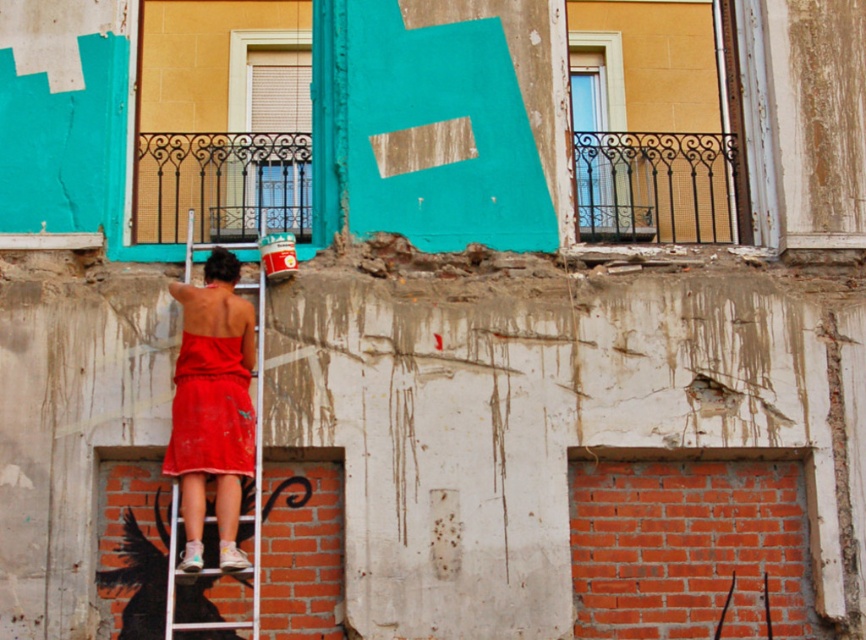
Question: Which object appears farthest from the camera in this image?

Choices:
 (A) white metallic ladder at center
 (B) teal matte letter at center

Answer: (B)

Question: Is teal matte letter at center positioned before white metallic ladder at center?

Choices:
 (A) no
 (B) yes

Answer: (A)

Question: Which point is closer to the camera?

Choices:
 (A) (427, 35)
 (B) (202, 518)

Answer: (B)

Question: Does teal matte letter at center have a smaller size compared to white metallic ladder at center?

Choices:
 (A) yes
 (B) no

Answer: (A)

Question: Is teal matte letter at center in front of white metallic ladder at center?

Choices:
 (A) yes
 (B) no

Answer: (B)